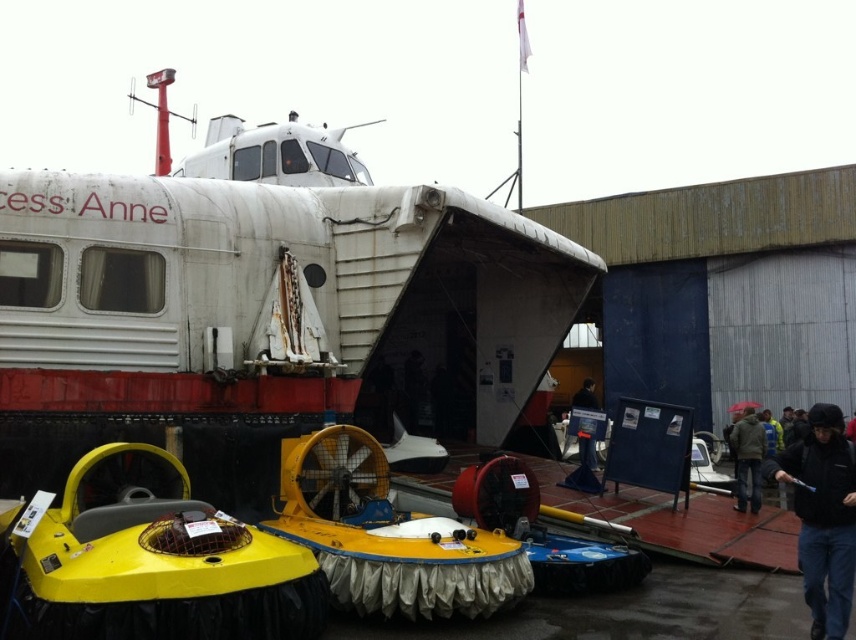
Question: Which of the following is the closest to the observer?

Choices:
 (A) brown fuzzy jacket at lower right
 (B) black matte jacket at lower right

Answer: (B)

Question: Is white matte boat at center wider than brown fuzzy jacket at lower right?

Choices:
 (A) no
 (B) yes

Answer: (B)

Question: Does black matte jacket at lower right appear on the right side of black jacket at lower right?

Choices:
 (A) no
 (B) yes

Answer: (B)

Question: Which point is closer to the camera?

Choices:
 (A) (580, 396)
 (B) (753, 499)

Answer: (B)

Question: Which of these objects is positioned farthest from the black matte jacket at lower right?

Choices:
 (A) brown fuzzy jacket at lower right
 (B) black jacket at lower right

Answer: (B)

Question: Can you confirm if black matte jacket at lower right is wider than brown fuzzy jacket at lower right?

Choices:
 (A) yes
 (B) no

Answer: (A)